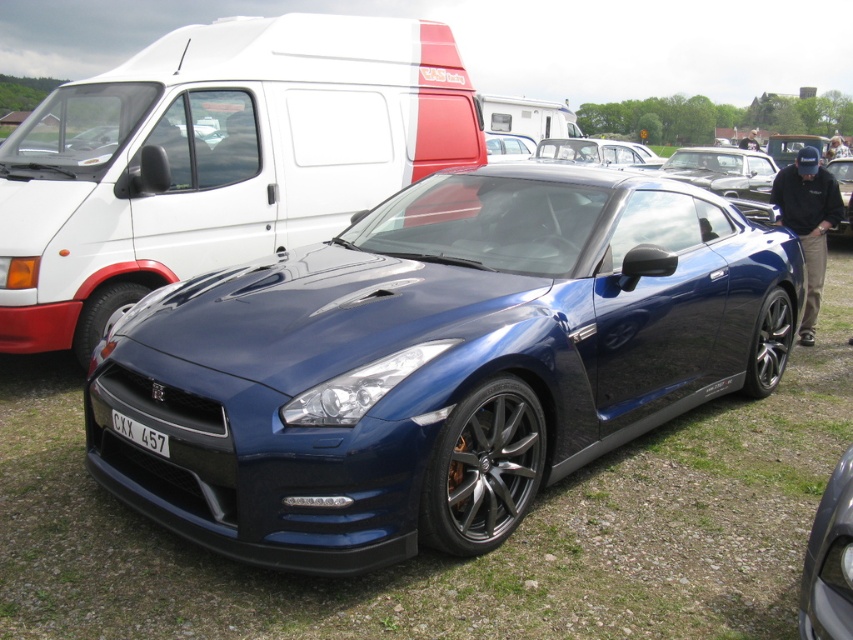
Can you confirm if glossy blue sports car at center is taller than white matte van at upper center?

In fact, glossy blue sports car at center may be shorter than white matte van at upper center.

Is point (260, 547) behind point (292, 221)?

That is False.

The height and width of the screenshot is (640, 853). What do you see at coordinates (436, 362) in the screenshot?
I see `glossy blue sports car at center` at bounding box center [436, 362].

The image size is (853, 640). What are the coordinates of `glossy blue sports car at center` in the screenshot? It's located at (436, 362).

Between point (259, 118) and point (837, 520), which one is positioned behind?

The point (259, 118) is more distant.

In the scene shown: Does white matte van at upper center have a greater width compared to glossy blue car at center?

Yes, white matte van at upper center is wider than glossy blue car at center.

The height and width of the screenshot is (640, 853). Describe the element at coordinates (216, 160) in the screenshot. I see `white matte van at upper center` at that location.

Locate an element on the screen. Image resolution: width=853 pixels, height=640 pixels. white matte van at upper center is located at coordinates (216, 160).

Can you confirm if glossy blue sports car at center is positioned to the left of white plastic license plate at center?

In fact, glossy blue sports car at center is to the right of white plastic license plate at center.

Is glossy blue sports car at center further to the viewer compared to white plastic license plate at center?

That is False.

At what (x,y) coordinates should I click in order to perform the action: click on glossy blue sports car at center. Please return your answer as a coordinate pair (x, y). The height and width of the screenshot is (640, 853). Looking at the image, I should click on (436, 362).